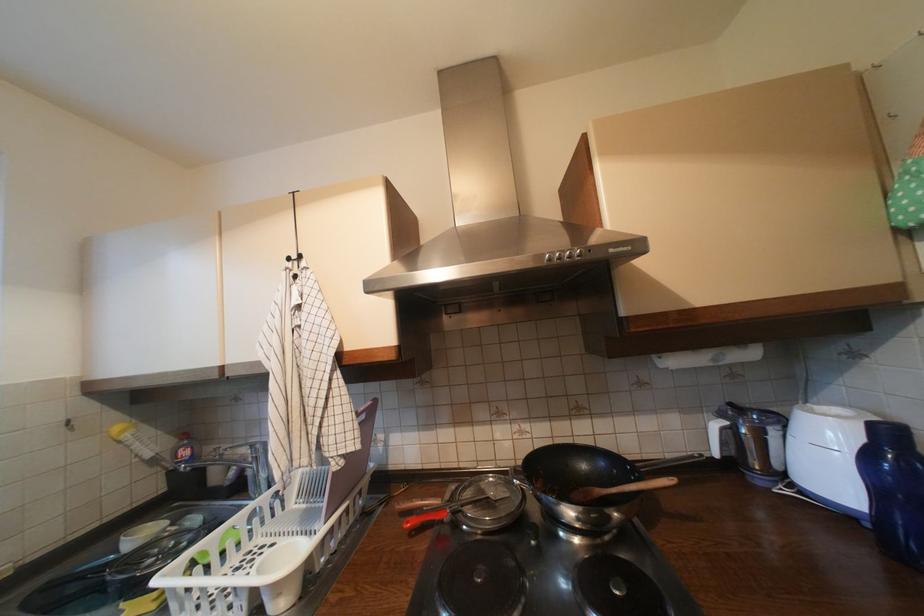
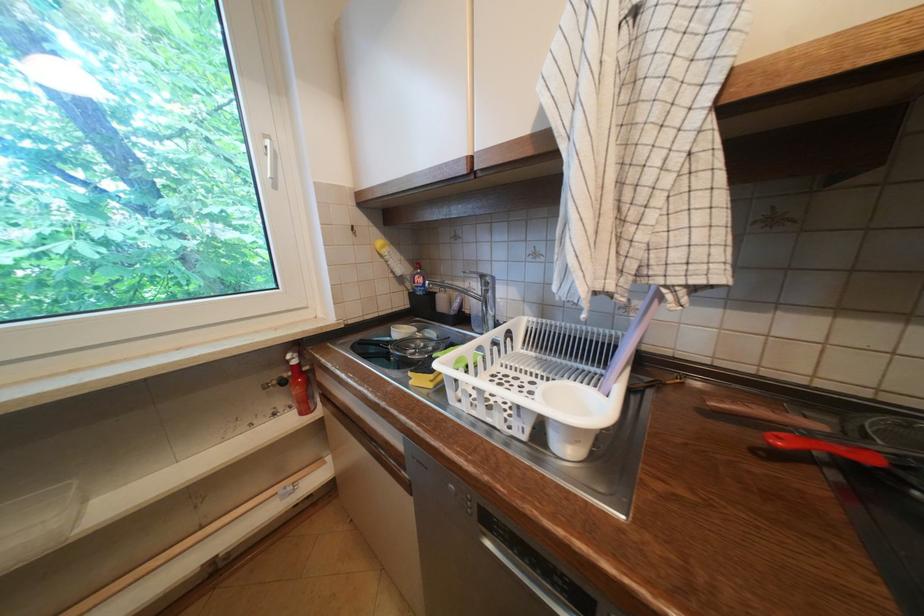
Where in the second image is the point corresponding to the point at 417,524 from the first image?

(788, 440)